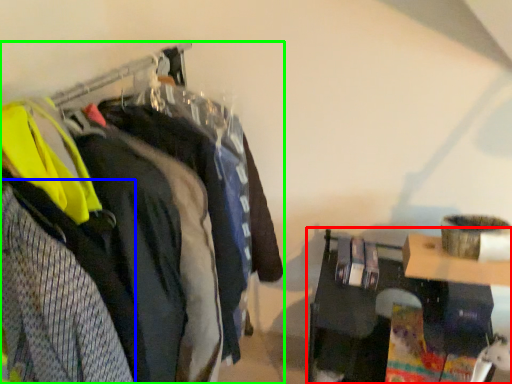
Question: Which is farther away from furniture (highlighted by a red box)? clothing (highlighted by a blue box) or closet (highlighted by a green box)?

Choices:
 (A) clothing
 (B) closet

Answer: (A)